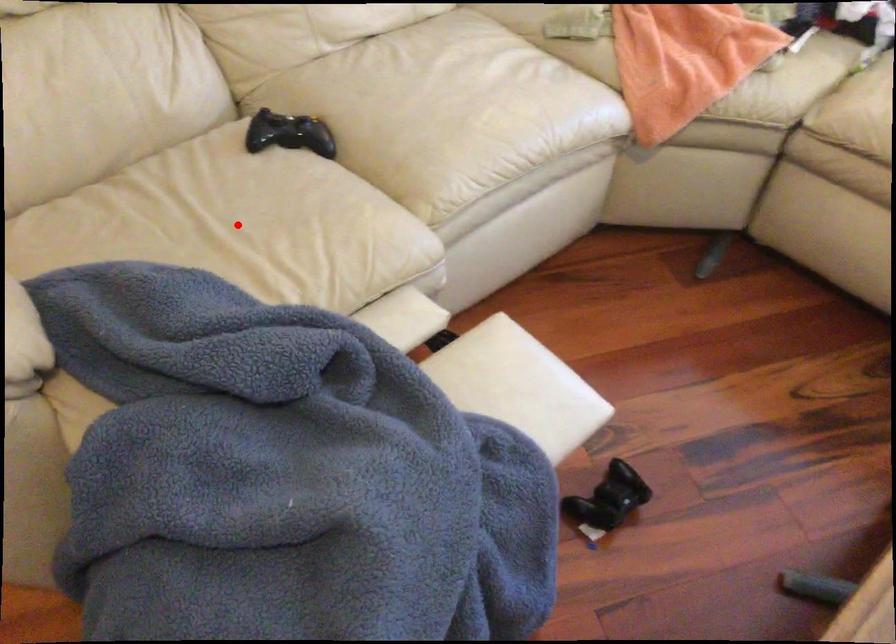
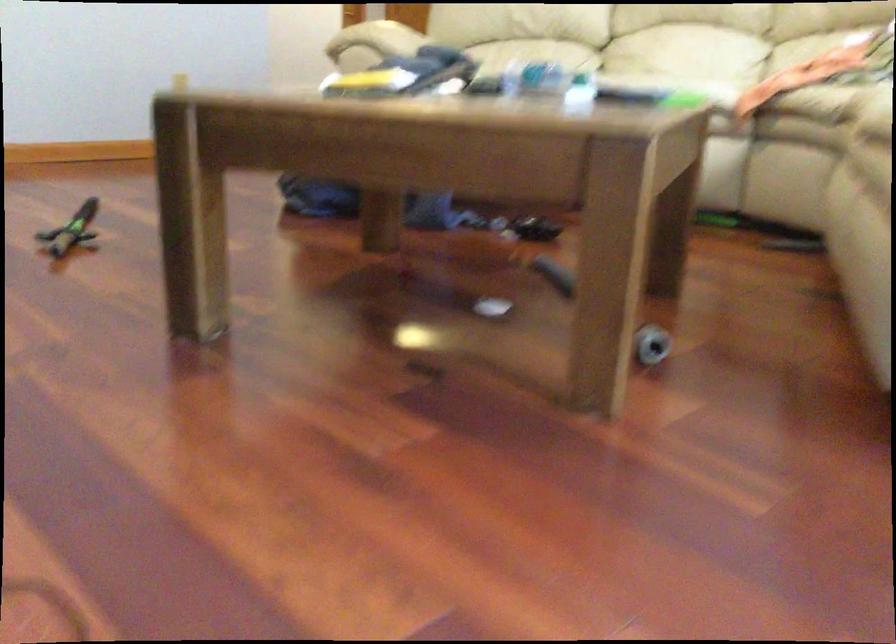
Question: I am providing you with two images of the same scene from different viewpoints. A red point is marked on the first image. Can you still see the location of the red point in image 2?

Choices:
 (A) Yes
 (B) No

Answer: (B)